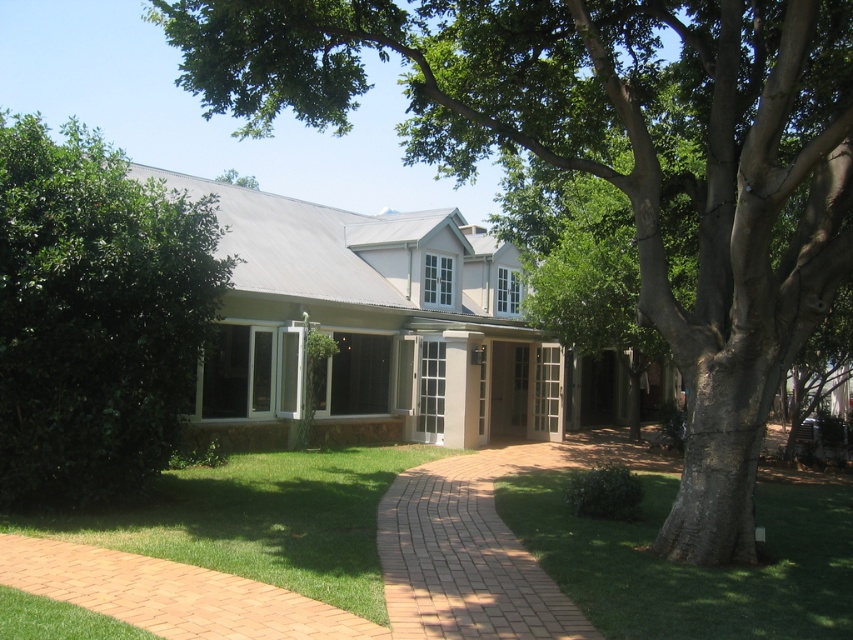
Question: Which point is closer to the camera taking this photo?

Choices:
 (A) (164, 292)
 (B) (577, 458)

Answer: (A)

Question: Which of the following is the closest to the observer?

Choices:
 (A) green grass at lower left
 (B) green leafy hedge at left
 (C) green rough bark tree at center
 (D) brick at center

Answer: (A)

Question: Where is green grass at lower left located in relation to brick at center in the image?

Choices:
 (A) above
 (B) below

Answer: (A)

Question: Does green grass at lower left have a smaller size compared to green grass at lower right?

Choices:
 (A) no
 (B) yes

Answer: (A)

Question: Does green rough bark tree at center appear under green grass at lower right?

Choices:
 (A) no
 (B) yes

Answer: (A)

Question: Based on their relative distances, which object is farther from the green leafy hedge at left?

Choices:
 (A) green rough bark tree at center
 (B) green grass at lower left
 (C) brick at center

Answer: (C)